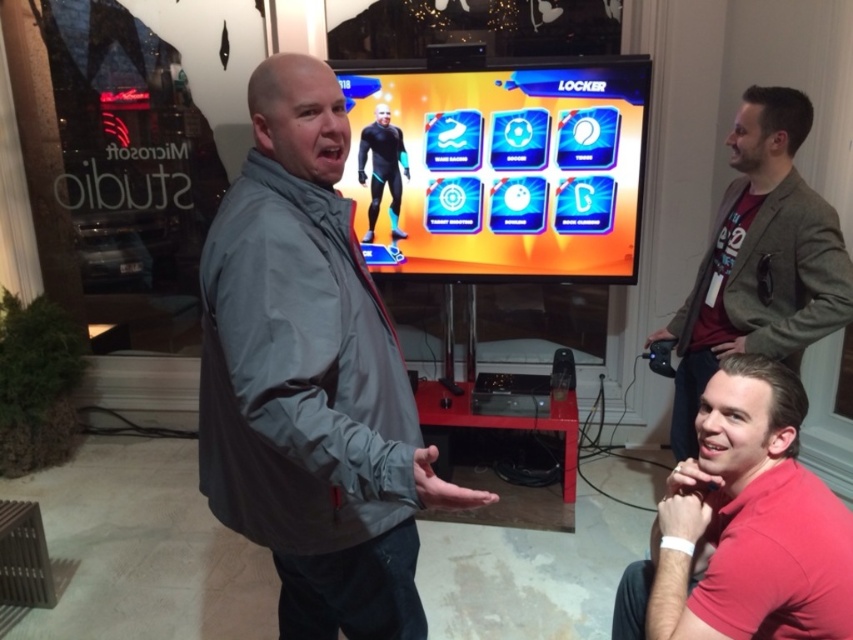
Which is behind, point (389, 150) or point (743, 310)?

The point (389, 150) is behind.

Does shiny plastic game at center lie behind green textured blazer at upper right?

Yes, shiny plastic game at center is further from the viewer.

What do you see at coordinates (502, 168) in the screenshot?
I see `shiny plastic game at center` at bounding box center [502, 168].

Locate an element on the screen. The width and height of the screenshot is (853, 640). shiny plastic game at center is located at coordinates (502, 168).

Does shiny plastic game at center have a lesser width compared to red cotton shirt at lower right?

No, shiny plastic game at center is not thinner than red cotton shirt at lower right.

Can you confirm if shiny plastic game at center is wider than red cotton shirt at lower right?

Yes.

Locate an element on the screen. The height and width of the screenshot is (640, 853). shiny plastic game at center is located at coordinates (502, 168).

Find the location of a particular element. Image resolution: width=853 pixels, height=640 pixels. gray matte jacket at center is located at coordinates (310, 378).

What do you see at coordinates (310, 378) in the screenshot?
I see `gray matte jacket at center` at bounding box center [310, 378].

Find the location of `gray matte jacket at center`. gray matte jacket at center is located at coordinates (310, 378).